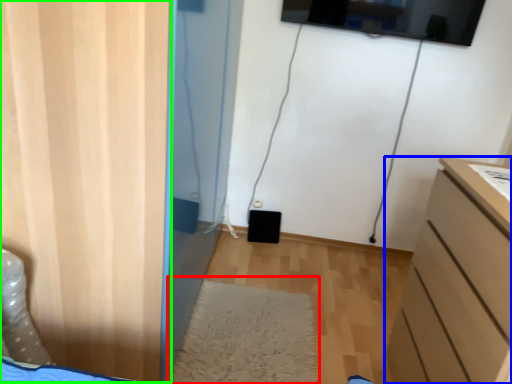
Question: Estimate the real-world distances between objects in this image. Which object is closer to mat (highlighted by a red box), chest of drawers (highlighted by a blue box) or door (highlighted by a green box)?

Choices:
 (A) chest of drawers
 (B) door

Answer: (A)